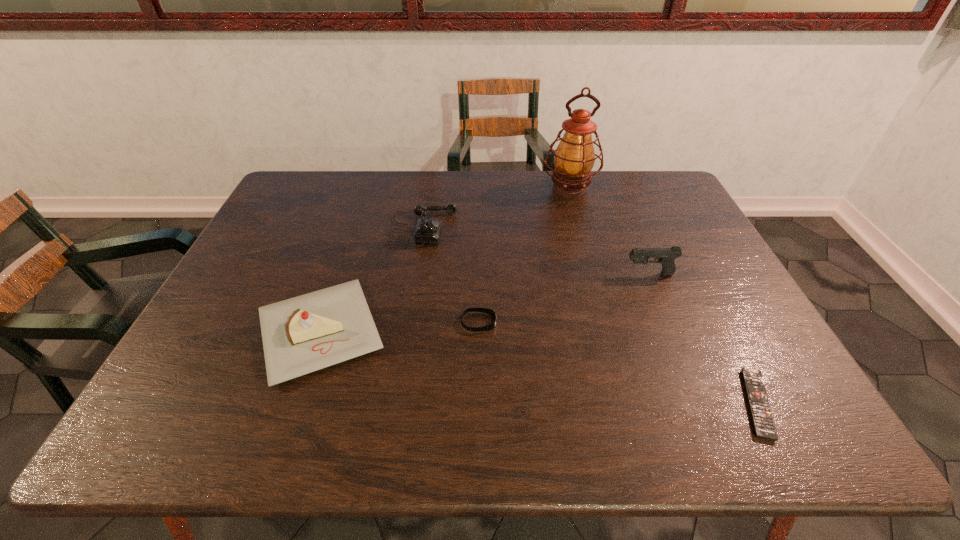
Where is `vacant area that lies between the pistol and the telephone`? vacant area that lies between the pistol and the telephone is located at coordinates (536, 251).

This screenshot has height=540, width=960. Identify the location of vacant space in between the cake and the tallest object. (444, 260).

The width and height of the screenshot is (960, 540). I want to click on vacant space that's between the cake and the fourth nearest object, so click(485, 302).

This screenshot has height=540, width=960. I want to click on vacant area that lies between the second tallest object and the remote control, so click(703, 339).

At what (x,y) coordinates should I click in order to perform the action: click on free space that is in between the second farthest object and the second shortest object. Please return your answer as a coordinate pair (x, y). The width and height of the screenshot is (960, 540). Looking at the image, I should click on (450, 275).

Locate an element on the screen. The width and height of the screenshot is (960, 540). vacant region between the rightmost object and the pistol is located at coordinates (703, 339).

Where is `free spot between the telephone and the remote control`? This screenshot has height=540, width=960. free spot between the telephone and the remote control is located at coordinates (589, 316).

The width and height of the screenshot is (960, 540). I want to click on free spot between the telephone and the fifth tallest object, so click(x=450, y=275).

This screenshot has height=540, width=960. Identify the location of the closest object to the shortest object. (666, 256).

Where is `object that can be found as the third closest to the third object from left to right`? The height and width of the screenshot is (540, 960). object that can be found as the third closest to the third object from left to right is located at coordinates (666, 256).